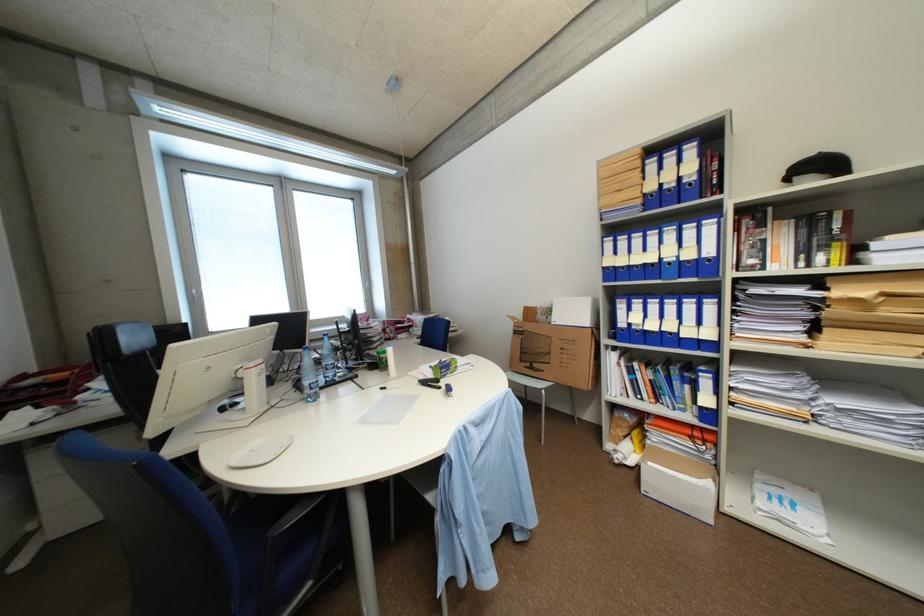
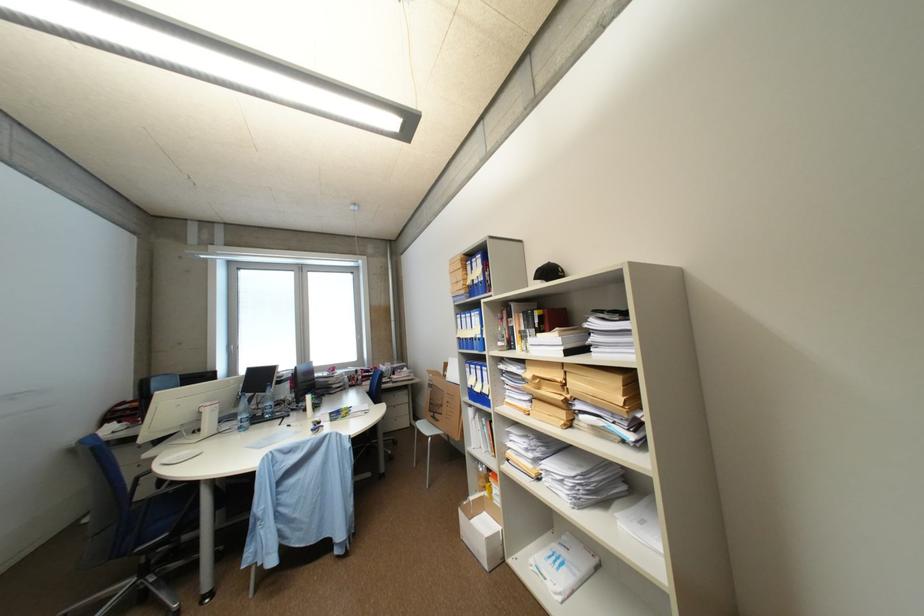
Question: Which direction would the cameraman need to move to produce the second image? Reply with the corresponding letter.

Choices:
 (A) Left
 (B) Right
 (C) Forward
 (D) Backward

Answer: (B)